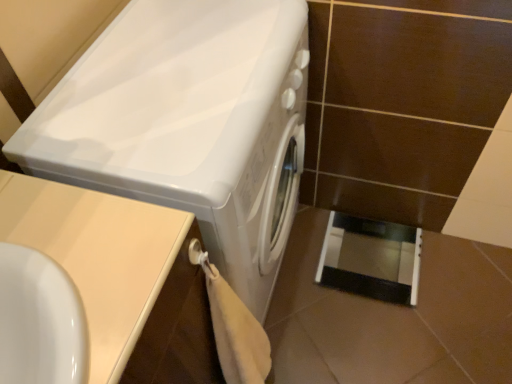
Question: Is beige laminate counter top at lower left not near black glossy screen door at lower right?

Choices:
 (A) yes
 (B) no

Answer: (A)

Question: Is beige laminate counter top at lower left not inside black glossy screen door at lower right?

Choices:
 (A) yes
 (B) no

Answer: (A)

Question: Considering the relative sizes of beige laminate counter top at lower left and black glossy screen door at lower right in the image provided, is beige laminate counter top at lower left wider than black glossy screen door at lower right?

Choices:
 (A) yes
 (B) no

Answer: (A)

Question: From the image's perspective, is beige laminate counter top at lower left above black glossy screen door at lower right?

Choices:
 (A) yes
 (B) no

Answer: (B)

Question: Is beige laminate counter top at lower left thinner than black glossy screen door at lower right?

Choices:
 (A) no
 (B) yes

Answer: (A)

Question: In the image, is black glossy screen door at lower right positioned in front of or behind beige laminate counter top at lower left?

Choices:
 (A) front
 (B) behind

Answer: (B)

Question: From a real-world perspective, is black glossy screen door at lower right above or below beige laminate counter top at lower left?

Choices:
 (A) below
 (B) above

Answer: (A)

Question: Based on their positions, is black glossy screen door at lower right located to the left or right of beige laminate counter top at lower left?

Choices:
 (A) left
 (B) right

Answer: (B)

Question: Is black glossy screen door at lower right spatially inside beige laminate counter top at lower left, or outside of it?

Choices:
 (A) outside
 (B) inside

Answer: (A)

Question: From a real-world perspective, is white glossy washing machine at center positioned above or below black glossy screen door at lower right?

Choices:
 (A) above
 (B) below

Answer: (A)

Question: Considering the positions of point (185, 19) and point (386, 251), is point (185, 19) closer or farther from the camera than point (386, 251)?

Choices:
 (A) farther
 (B) closer

Answer: (B)

Question: From the image's perspective, is white glossy washing machine at center above or below black glossy screen door at lower right?

Choices:
 (A) above
 (B) below

Answer: (A)

Question: Based on their positions, is white glossy washing machine at center located to the left or right of black glossy screen door at lower right?

Choices:
 (A) right
 (B) left

Answer: (B)

Question: In terms of size, does beige laminate counter top at lower left appear bigger or smaller than black glossy screen door at lower right?

Choices:
 (A) big
 (B) small

Answer: (A)

Question: From a real-world perspective, is beige laminate counter top at lower left physically located above or below black glossy screen door at lower right?

Choices:
 (A) below
 (B) above

Answer: (B)